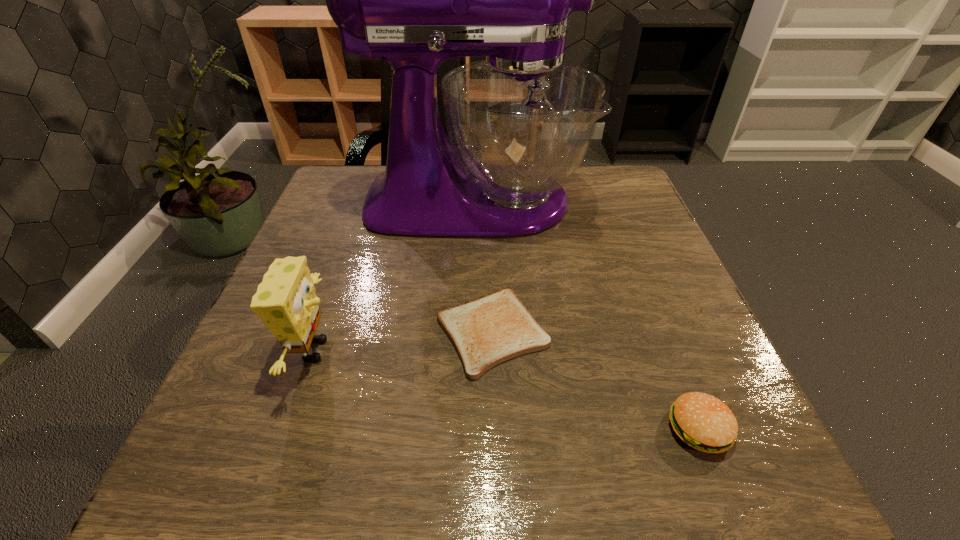
This screenshot has height=540, width=960. What are the coordinates of `mixer` in the screenshot? It's located at (520, 122).

The height and width of the screenshot is (540, 960). I want to click on the farthest object, so click(x=520, y=122).

Where is `the second tallest object`? Image resolution: width=960 pixels, height=540 pixels. the second tallest object is located at coordinates (285, 300).

The image size is (960, 540). Find the location of `the third tallest object`. the third tallest object is located at coordinates (702, 421).

Locate an element on the screen. The height and width of the screenshot is (540, 960). the rightmost object is located at coordinates (702, 421).

What are the coordinates of `the shortest object` in the screenshot? It's located at (489, 330).

Find the location of `free point located at the bowl opening of the farthest object`. free point located at the bowl opening of the farthest object is located at coordinates (611, 201).

Where is `vacant space located 0.370m on the face of the sponge`? vacant space located 0.370m on the face of the sponge is located at coordinates (550, 350).

Identify the location of free space located 0.140m on the left of the second shortest object. (574, 428).

You are a GUI agent. You are given a task and a screenshot of the screen. Output one action in this format:
    pyautogui.click(x=<x>, y=<y>)
    Task: Click on the vacant position located on the front of the toast
    
    Given the screenshot: What is the action you would take?
    pyautogui.click(x=494, y=407)